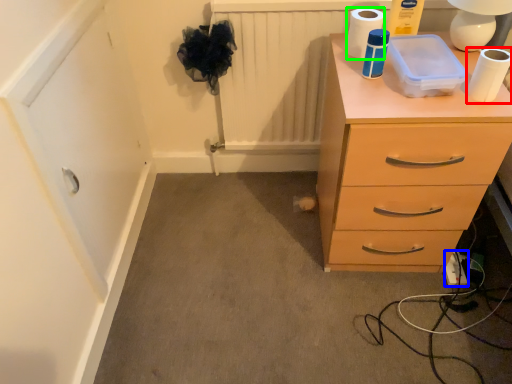
Question: Estimate the real-world distances between objects in this image. Which object is closer to toilet paper (highlighted by a red box), extension cord (highlighted by a blue box) or toilet paper (highlighted by a green box)?

Choices:
 (A) extension cord
 (B) toilet paper

Answer: (B)